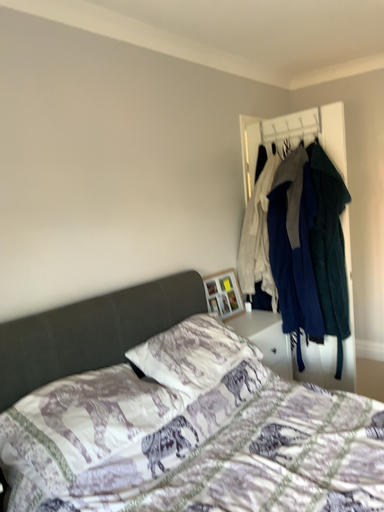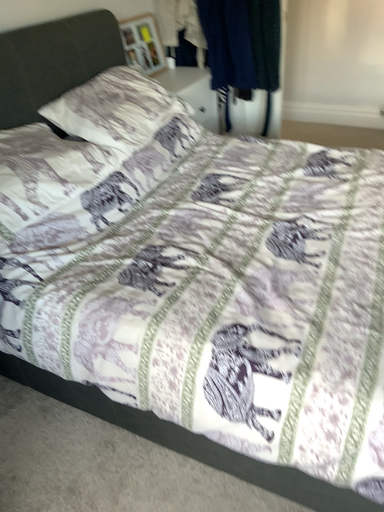
Question: Which way did the camera rotate in the video?

Choices:
 (A) rotated downward
 (B) rotated upward

Answer: (A)